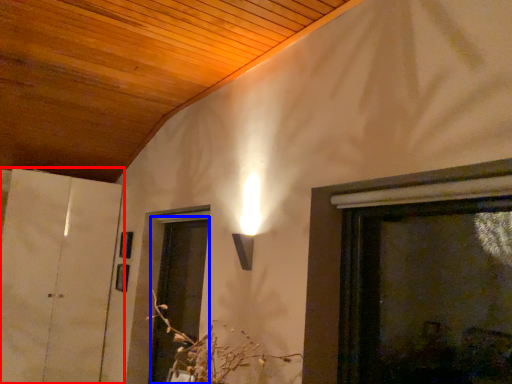
Question: Among these objects, which one is farthest to the camera, door (highlighted by a red box) or screen door (highlighted by a blue box)?

Choices:
 (A) door
 (B) screen door

Answer: (A)